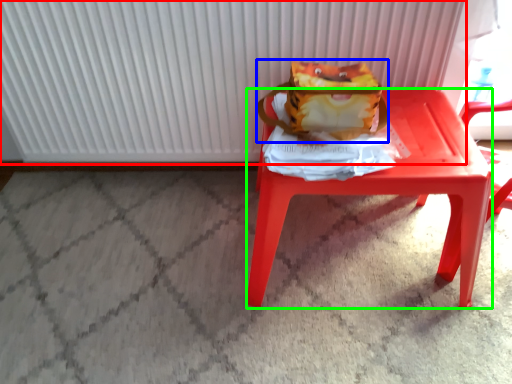
Question: Which is nearer to the radiator (highlighted by a red box)? shoulder bag (highlighted by a blue box) or stool (highlighted by a green box).

Choices:
 (A) shoulder bag
 (B) stool

Answer: (A)